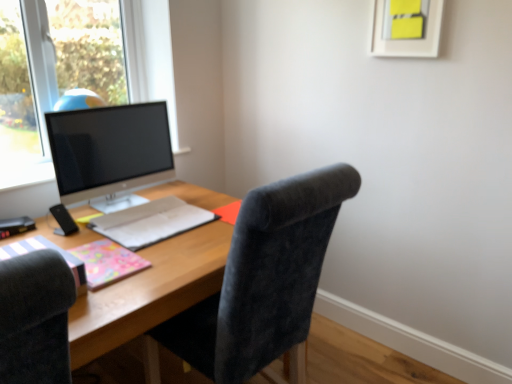
I want to click on free location to the right of matte pink notebook at left, the 1th notebook from the front, so click(122, 292).